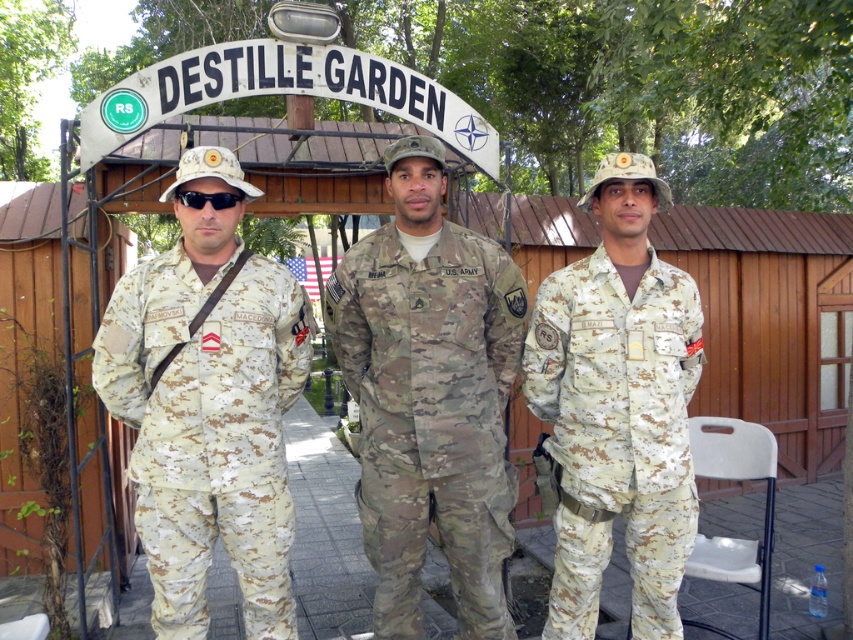
Can you confirm if multicam uniform at center is wider than black matte goggles at center?

Yes, multicam uniform at center is wider than black matte goggles at center.

Is point (397, 628) farther from viewer compared to point (210, 195)?

Yes, point (397, 628) is behind point (210, 195).

Which is behind, point (495, 385) or point (216, 195)?

The point (495, 385) is behind.

You are a GUI agent. You are given a task and a screenshot of the screen. Output one action in this format:
    pyautogui.click(x=<x>, y=<y>)
    Task: Click on the multicam uniform at center
    
    Given the screenshot: What is the action you would take?
    pyautogui.click(x=431, y=416)

Can you confirm if camouflage fabric uniform at left is positioned to the left of black matte goggles at center?

Indeed, camouflage fabric uniform at left is positioned on the left side of black matte goggles at center.

Which of these two, camouflage fabric uniform at left or black matte goggles at center, stands shorter?

Standing shorter between the two is black matte goggles at center.

Is point (173, 364) positioned after point (181, 195)?

No, it is in front of (181, 195).

Find the location of a particular element. This screenshot has width=853, height=640. camouflage fabric uniform at left is located at coordinates (207, 429).

Is camouflage fabric uniform at center positioned behind black matte goggles at center?

Yes, it is.

Who is positioned more to the left, camouflage fabric uniform at center or black matte goggles at center?

black matte goggles at center

The width and height of the screenshot is (853, 640). What do you see at coordinates (618, 433) in the screenshot?
I see `camouflage fabric uniform at center` at bounding box center [618, 433].

The height and width of the screenshot is (640, 853). Find the location of `camouflage fabric uniform at center`. camouflage fabric uniform at center is located at coordinates (618, 433).